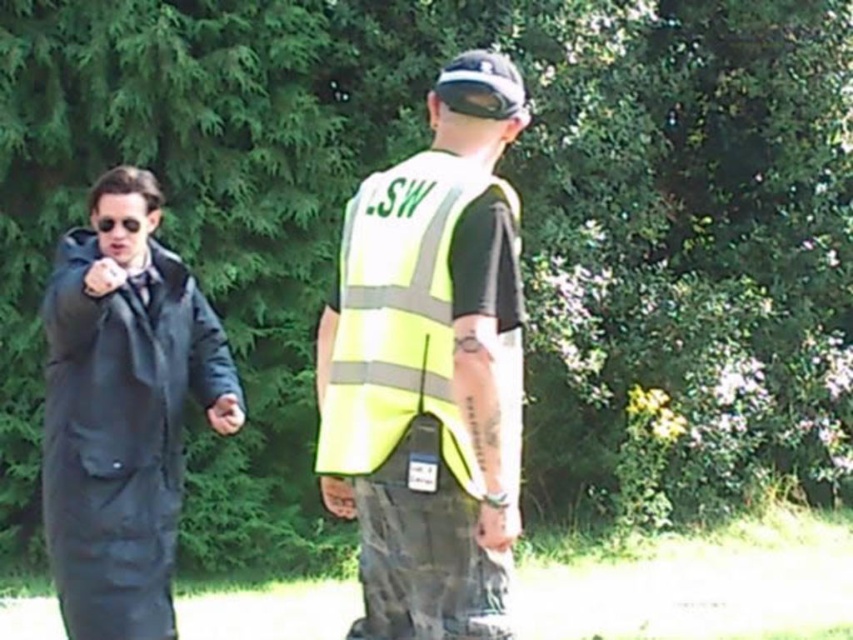
You are a pedestrian standing in the park and want to cross the path where the matte black coat at left and the yellow reflective vest at center are located. Which object is closer to you, and would you need to step around it first?

The matte black coat at left is closer to you than the yellow reflective vest at center. You should step around the matte black coat at left first before proceeding further.

You are a drone operator trying to locate two people in a park. The drone has a camera with a field of view that can only capture objects within a 0.5 radius from the center. If you center the camera at point 0.5, 0.5, will the matte black coat at left be within the camera view?

The position of matte black coat at left is at point (123, 410). The distance from the center point (426, 320) to this position is sqrt. The distance from the center point (426, 320) to the matte black coat at left is sqrt. The distance from the center point (426, 320) to the matte black coat at left is sqrt. The distance from the center point (426, 320) to the matte black coat at left is sqrt. The distance from the center point (426, 320) to the matte black coat at left is sqrt. The distance from the center point

You are a pedestrian trying to cross the road where these two individuals are standing. The person in the matte black coat at left is blocking your path. Can you see the yellow reflective vest at center over their shoulder? Please explain.

The matte black coat at left has a greater height compared to yellow reflective vest at center. Since the person in the matte black coat at left is taller, their shoulder might block your view of the yellow reflective vest at center unless you move to a position where you can see around them.